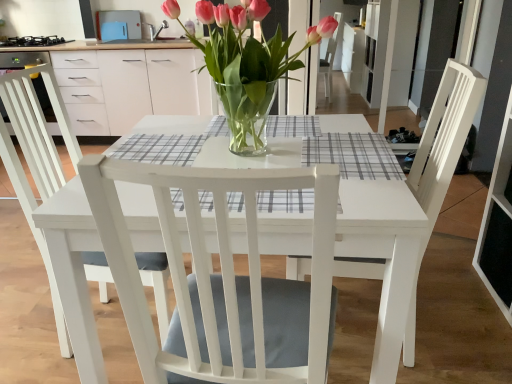
Question: In the image, is gray checkered placemat at center, marked as the 2th plaid in a bottom-to-top arrangement, on the left side or the right side of white wood chair at center, positioned as the second chair in right-to-left order?

Choices:
 (A) right
 (B) left

Answer: (A)

Question: Considering the positions of gray checkered placemat at center, which is the second plaid from front to back, and white wood chair at center, positioned as the second chair in right-to-left order, in the image, is gray checkered placemat at center, which is the second plaid from front to back, taller or shorter than white wood chair at center, positioned as the second chair in right-to-left order,?

Choices:
 (A) short
 (B) tall

Answer: (A)

Question: Estimate the real-world distances between objects in this image. Which object is farther from the clear glass vase at center?

Choices:
 (A) white wood chair at center, the 2th chair positioned from the left
 (B) white wood chair at center, the 1th chair viewed from the left
 (C) plaid fabric at center, which ranks as the second plaid in top-to-bottom order
 (D) black matte stove at upper left
 (E) gray checkered placemat at center, the 1th plaid positioned from the top

Answer: (D)

Question: Which object is the farthest from the plaid fabric at center, acting as the 2th plaid starting from the back?

Choices:
 (A) gray checkered placemat at center, which is the first plaid in back-to-front order
 (B) clear glass vase at center
 (C) white wood chair at center, the 2th chair positioned from the left
 (D) white wood chair at center, the 1th chair viewed from the left
 (E) black matte stove at upper left

Answer: (E)